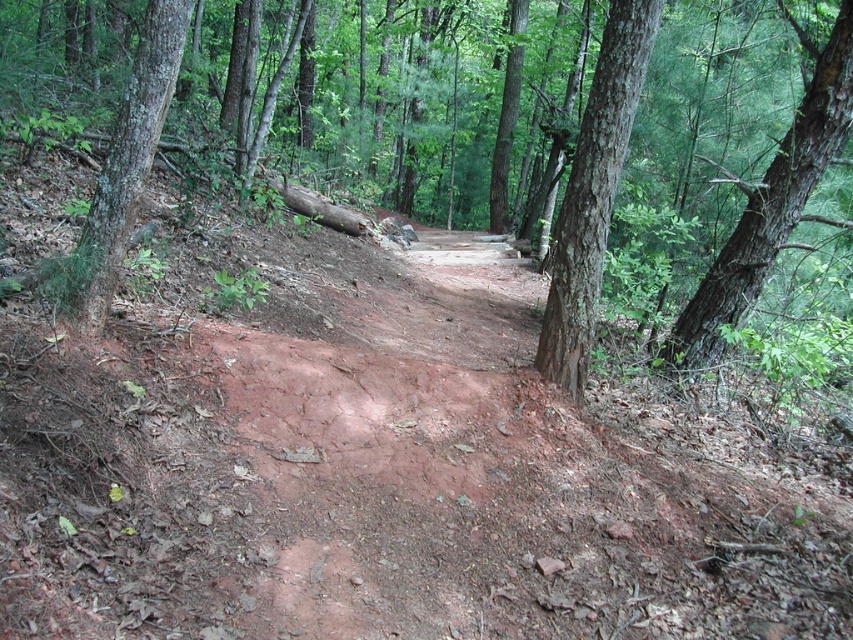
Question: Is smooth bark tree at center wider than brown rough bark tree at left?

Choices:
 (A) no
 (B) yes

Answer: (A)

Question: Is brown rough tree at center thinner than brown rough bark tree at left?

Choices:
 (A) yes
 (B) no

Answer: (B)

Question: Is brown rough tree at center thinner than smooth bark tree at center?

Choices:
 (A) no
 (B) yes

Answer: (A)

Question: Which point is closer to the camera taking this photo?

Choices:
 (A) (592, 138)
 (B) (776, 209)
 (C) (132, 122)
 (D) (519, 125)

Answer: (C)

Question: Considering the real-world distances, which object is closest to the green rough bark tree at center right?

Choices:
 (A) brown rough tree at center
 (B) smooth bark tree at center

Answer: (B)

Question: Among these objects, which one is nearest to the camera?

Choices:
 (A) smooth bark tree at center
 (B) brown rough bark tree at left

Answer: (B)